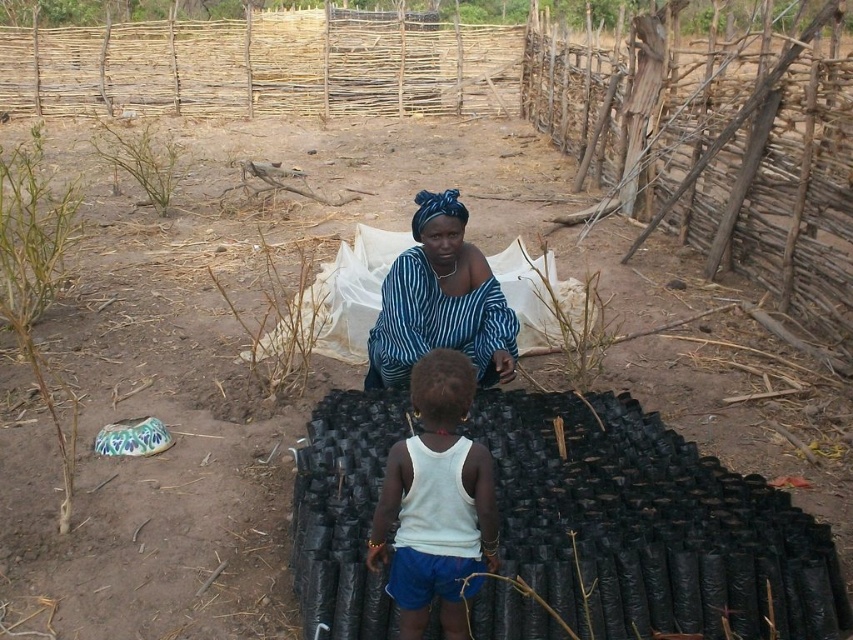
Question: Among these points, which one is nearest to the camera?

Choices:
 (A) (457, 524)
 (B) (451, 296)

Answer: (A)

Question: Can you confirm if white matte tank top at center is bigger than blue striped fabric at center?

Choices:
 (A) no
 (B) yes

Answer: (A)

Question: Which point is closer to the camera?

Choices:
 (A) blue striped fabric at center
 (B) white matte tank top at center

Answer: (B)

Question: Is white matte tank top at center above blue striped fabric at center?

Choices:
 (A) no
 (B) yes

Answer: (A)

Question: Does white matte tank top at center have a larger size compared to blue striped fabric at center?

Choices:
 (A) yes
 (B) no

Answer: (B)

Question: Among these objects, which one is farthest from the camera?

Choices:
 (A) blue striped fabric at center
 (B) white matte tank top at center

Answer: (A)